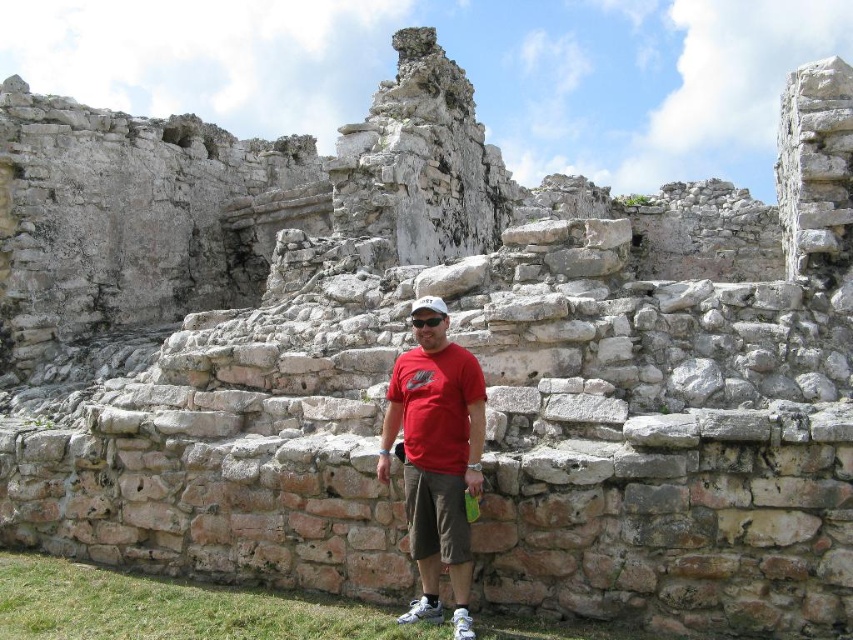
You are a photographer trying to capture the ruins in the image. You notice two specific points marked as point 1 at coordinates [479,387] and point 2 at coordinates [410,308]. Which point is positioned closer to the camera lens?

Point 1 at coordinates [479,387] is closer to the camera lens than point 2 at coordinates [410,308].